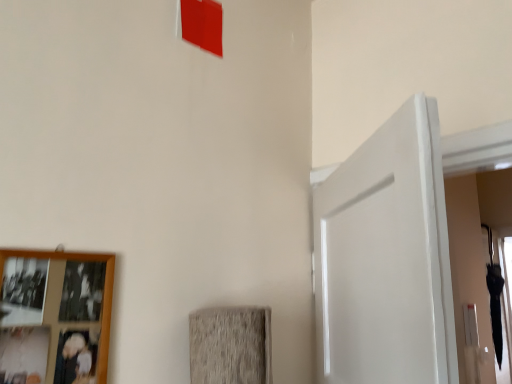
At what (x,y) coordinates should I click in order to perform the action: click on wooden photo frame at lower left. Please return your answer as a coordinate pair (x, y). The height and width of the screenshot is (384, 512). Looking at the image, I should click on (54, 316).

What do you see at coordinates (54, 316) in the screenshot?
I see `wooden photo frame at lower left` at bounding box center [54, 316].

Find the location of a particular element. wooden photo frame at lower left is located at coordinates (54, 316).